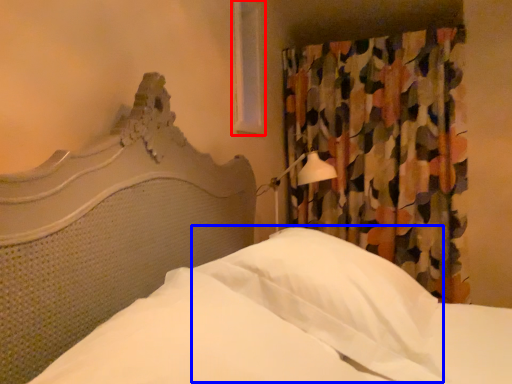
Question: Which of the following is the closest to the observer, window (highlighted by a red box) or pillow (highlighted by a blue box)?

Choices:
 (A) window
 (B) pillow

Answer: (B)